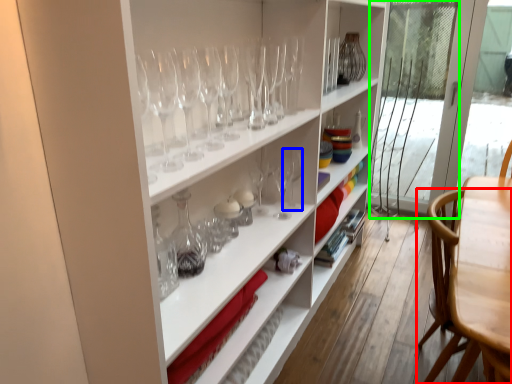
Question: Estimate the real-world distances between objects in this image. Which object is closer to chair (highlighted by a red box), wine glass (highlighted by a blue box) or screen door (highlighted by a green box)?

Choices:
 (A) wine glass
 (B) screen door

Answer: (A)